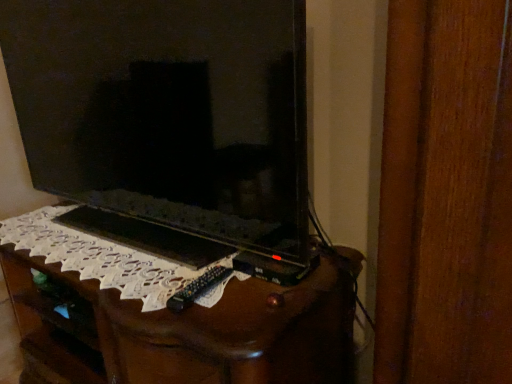
Question: In the image, is wooden tv stand at center positioned in front of or behind matte black tv at center?

Choices:
 (A) front
 (B) behind

Answer: (B)

Question: Does point coord(47,365) appear closer or farther from the camera than point coord(74,4)?

Choices:
 (A) closer
 (B) farther

Answer: (B)

Question: Would you say wooden tv stand at center is to the left or to the right of matte black tv at center in the picture?

Choices:
 (A) left
 (B) right

Answer: (B)

Question: Considering the positions of matte black tv at center and wooden tv stand at center in the image, is matte black tv at center taller or shorter than wooden tv stand at center?

Choices:
 (A) tall
 (B) short

Answer: (A)

Question: From the image's perspective, relative to wooden tv stand at center, is matte black tv at center above or below?

Choices:
 (A) below
 (B) above

Answer: (B)

Question: Is matte black tv at center inside or outside of wooden tv stand at center?

Choices:
 (A) inside
 (B) outside

Answer: (B)

Question: Looking at the image, does matte black tv at center seem bigger or smaller compared to wooden tv stand at center?

Choices:
 (A) small
 (B) big

Answer: (A)